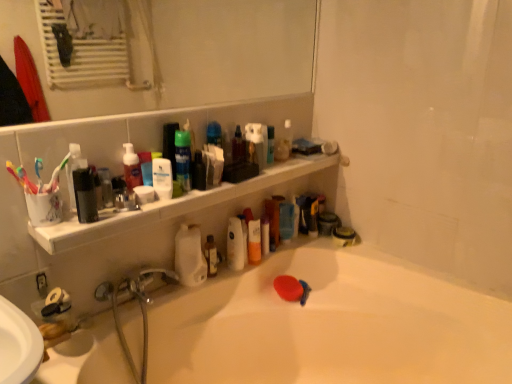
Question: Would you say white glossy bathtub at lower center is to the left or to the right of matte black soap at lower right, which is counted as the first toiletry, starting from the right, in the picture?

Choices:
 (A) left
 (B) right

Answer: (A)

Question: Is white glossy bathtub at lower center wider or thinner than matte black soap at lower right, which appears as the 1th toiletry when ordered from the bottom?

Choices:
 (A) wide
 (B) thin

Answer: (A)

Question: Which is farther from the matte black soap at lower right, which is counted as the first toiletry, starting from the right?

Choices:
 (A) translucent plastic spray bottle at upper center, which appears as the 3th toiletry when viewed from the left
 (B) white plastic toothbrush at left, which appears as the second toothbrush when viewed from the left
 (C) translucent plastic bottle at upper center, which is the third toiletry in back-to-front order
 (D) white matte bottle at center
 (E) matte black container at left, acting as the first mouthwash starting from the front

Answer: (B)

Question: Considering the real-world distances, which object is closest to the white matte lotion at upper center, which ranks as the third mouthwash in back-to-front order?

Choices:
 (A) green matte mouthwash at upper center, the fourth mouthwash viewed from the left
 (B) translucent plastic bottle at upper center, which is the third toiletry in back-to-front order
 (C) clear glass mirror at upper center
 (D) matte black bottle at upper left, marked as the 4th mouthwash in a back-to-front arrangement
 (E) white plastic toothbrush at left, the 1th toothbrush in the right-to-left sequence

Answer: (A)